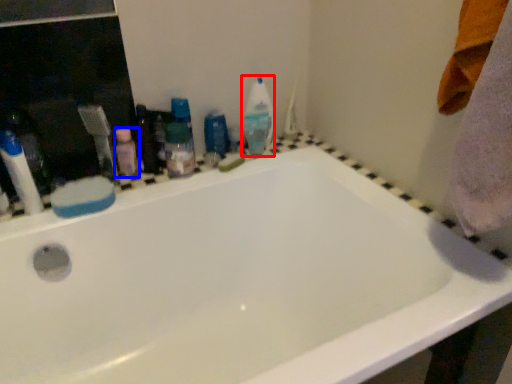
Question: Which point is further to the camera, cleaning product (highlighted by a red box) or toiletry (highlighted by a blue box)?

Choices:
 (A) cleaning product
 (B) toiletry

Answer: (A)